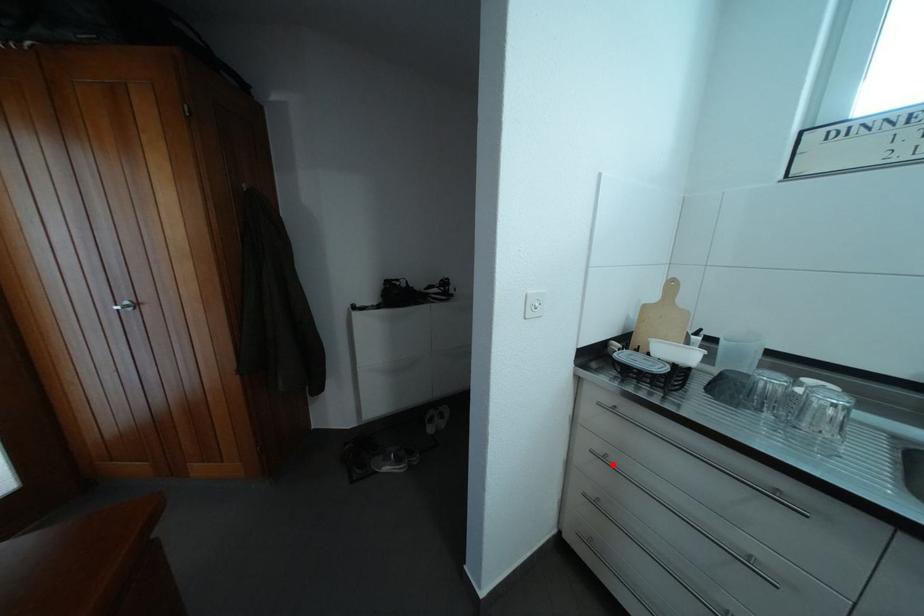
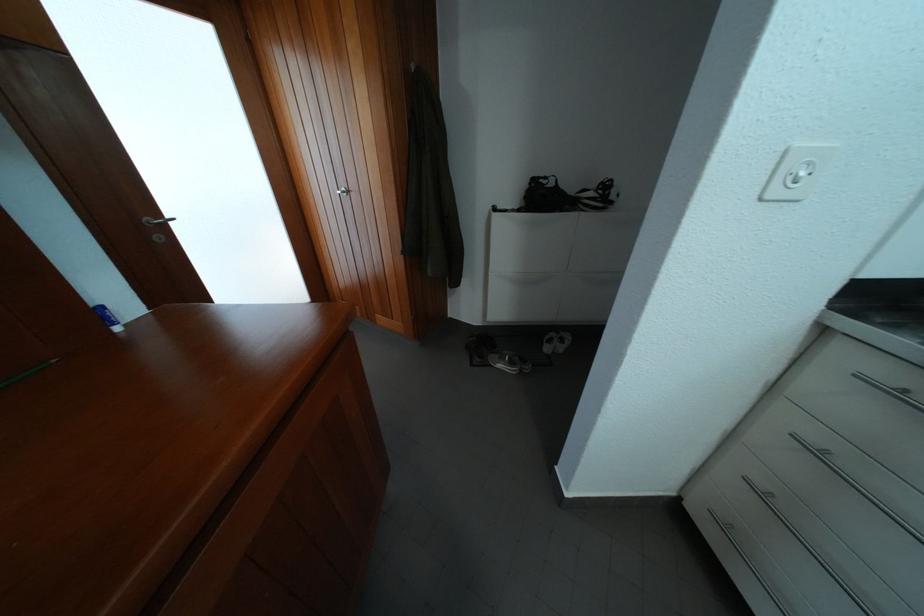
Locate, in the second image, the point that corresponds to the highlighted location in the first image.

(829, 460)